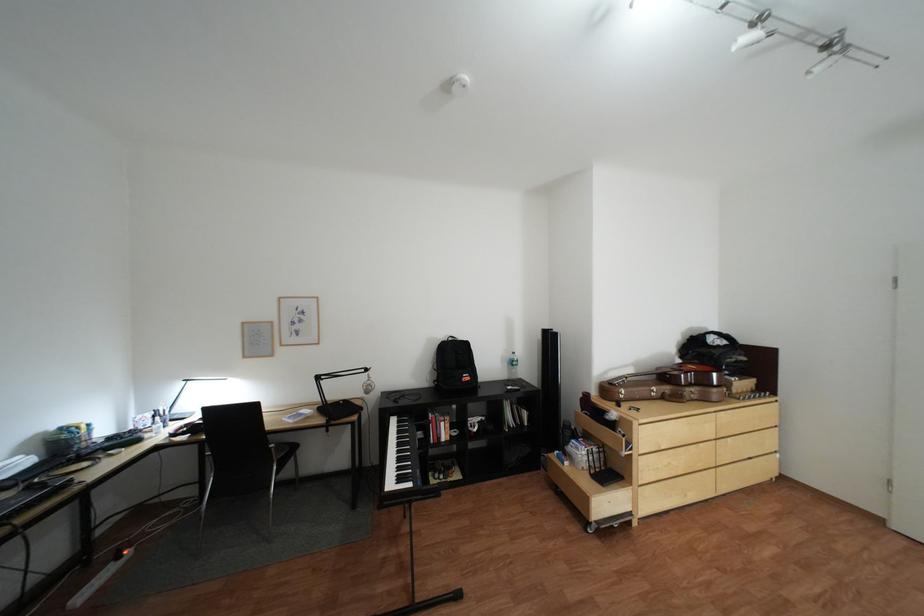
Where would you pull the wooden drawer handle? Please return your answer as a coordinate pair (x, y).

(749, 437)